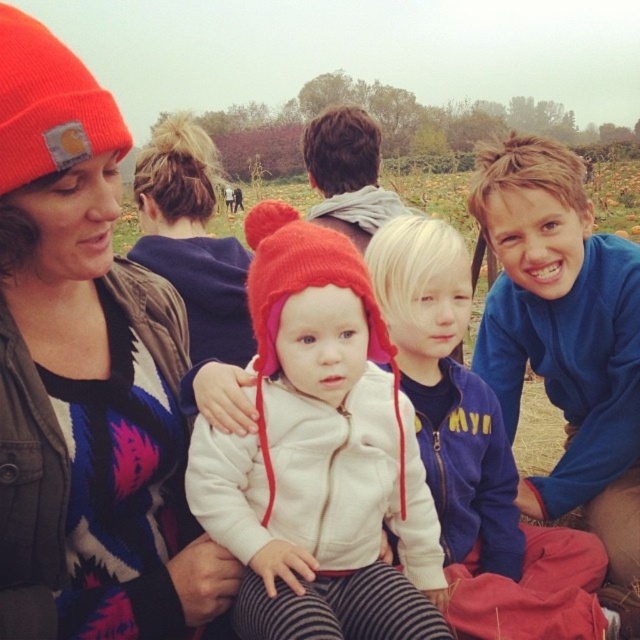
You are a photographer trying to capture a photo of the white fleece jacket at center without the matte orange beanie at upper left blocking it. What should you do?

Move the camera to the side so that the matte orange beanie at upper left is no longer in front of the white fleece jacket at center, allowing you to capture the jacket without obstruction.